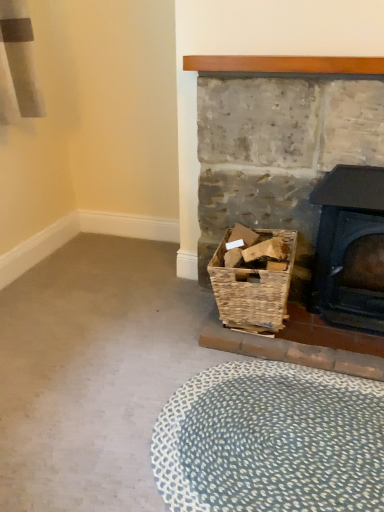
Find the location of a particular element. The width and height of the screenshot is (384, 512). vacant area located to the right-hand side of woven brown basket at lower right is located at coordinates (331, 345).